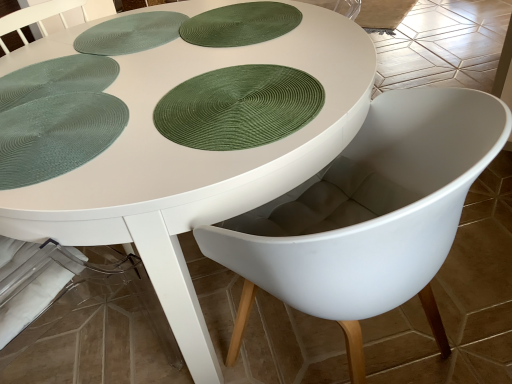
You are a GUI agent. You are given a task and a screenshot of the screen. Output one action in this format:
    pyautogui.click(x=<x>, y=<y>)
    Task: Click on the vacant area that lies in front of green textured placemat at upper left, the 2th paper plate when ordered from top to bottom
    The height and width of the screenshot is (384, 512).
    Given the screenshot: What is the action you would take?
    pyautogui.click(x=81, y=149)